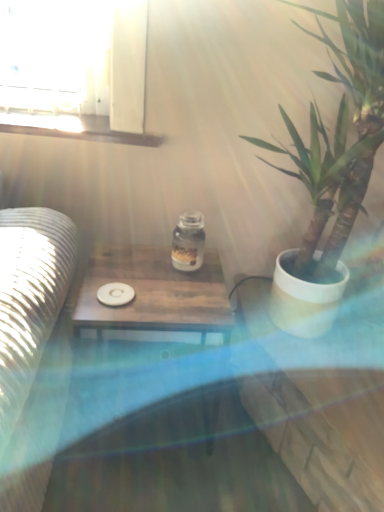
The height and width of the screenshot is (512, 384). In order to click on free spot to the left of transparent glass jar at center in this screenshot , I will do `click(138, 269)`.